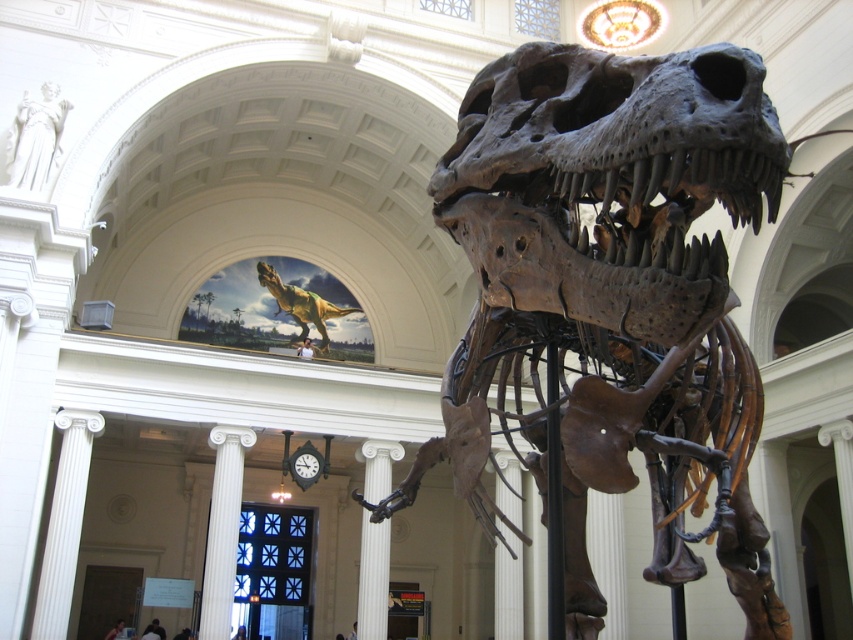
You are standing in the museum and want to take a photo of the Tyrannosaurus rex skeleton. The camera you are using has a focal length of 50mm. If the skeleton is located at point (383, 618), which is 212.55 feet away from you, will the skeleton fill the frame adequately for a clear photo?

The skeleton is 212.55 feet away from the viewer. With a 50mm lens, this distance may result in the skeleton appearing small in the frame. To fill the frame adequately, you might need a longer focal length or move closer if possible.

You are standing in the museum and want to take a photo of the Tyrannosaurus rex skeleton. The camera you are using has a maximum focus distance of 18 meters. Will you be able to focus on the point at coordinates (593, 330)?

The point at coordinates (593, 330) is 17.97 meters away from the camera, which is within the maximum focus distance of 18 meters. Therefore, the camera should be able to focus on that point.

Based on the photo, you are an interior designer planning to place a large sculpture in the museum. The sculpture requires a base that must be smaller than the existing white marble column at center and white marble pillar at center. Which of the two should you choose as a reference for the base size?

The white marble pillar at center is smaller than the white marble column at center, so you should use the white marble pillar at center as the reference for the base size to ensure the sculpture base is smaller than both.